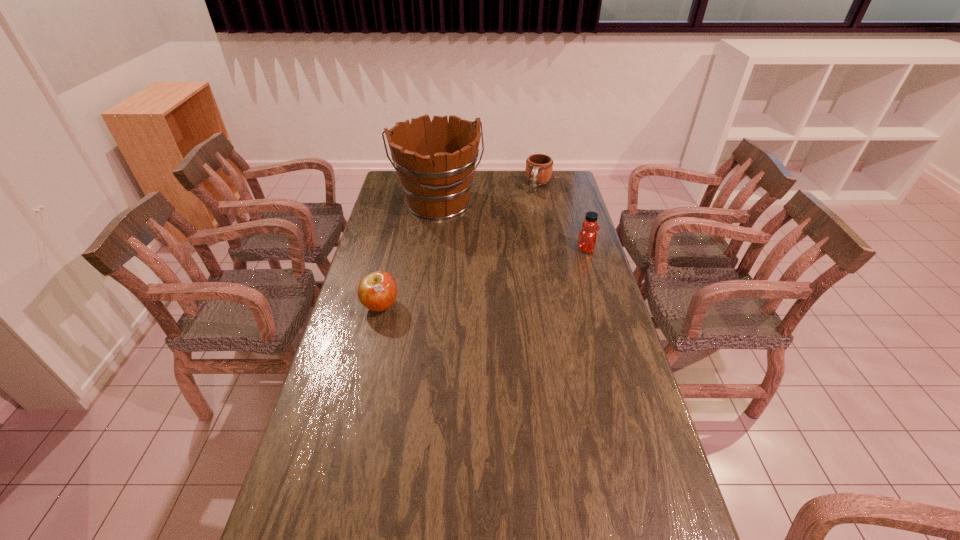
Locate an element on the screen. The image size is (960, 540). vacant spot on the desktop that is between the apple and the second nearest object and is positioned with the handle on the tallest object is located at coordinates (467, 282).

You are a GUI agent. You are given a task and a screenshot of the screen. Output one action in this format:
    pyautogui.click(x=<x>, y=<y>)
    Task: Click on the free spot on the desktop that is between the apple and the second nearest object and is positioned on the side of the second object from right to left with the handle
    
    Given the screenshot: What is the action you would take?
    pyautogui.click(x=502, y=273)